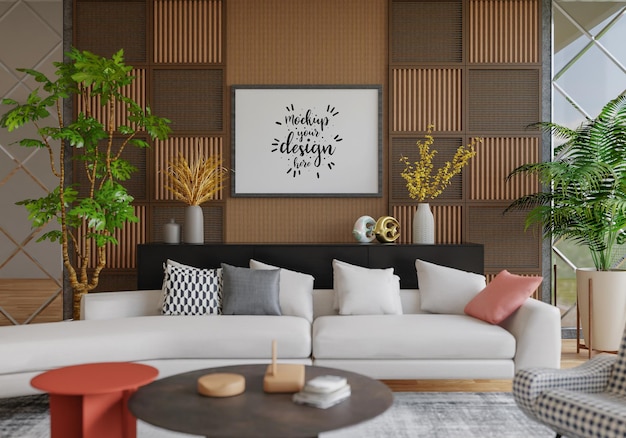
Identify the location of small brown coffee table. (212, 412).